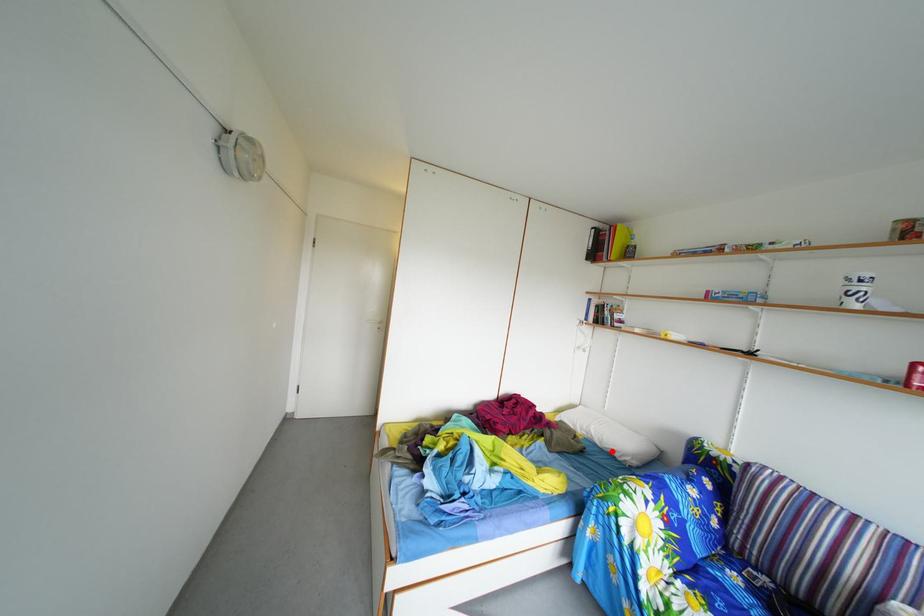
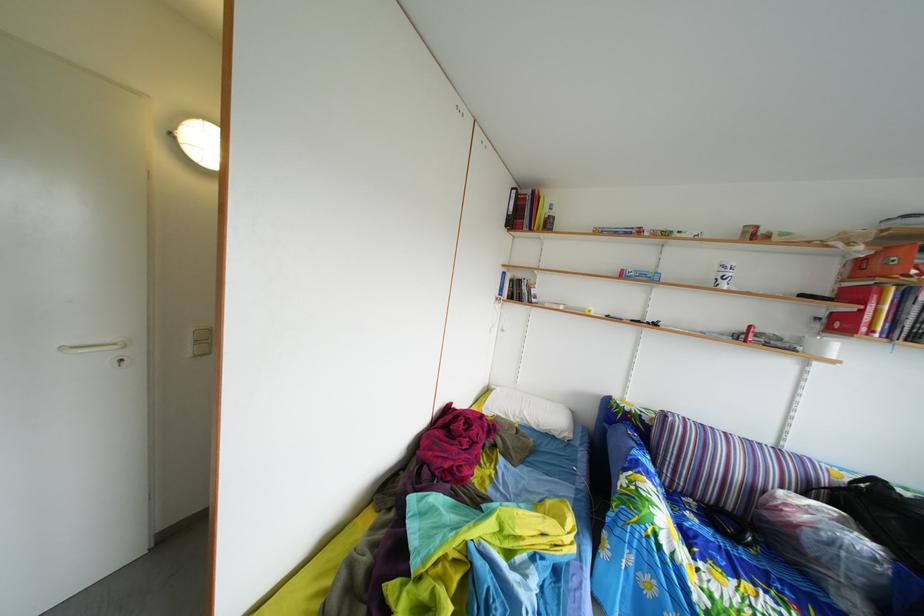
Question: I am providing you with two images of the same scene from different viewpoints. A red point is shown in image1. For the corresponding object point in image2, is it positioned nearer or farther from the camera?

Choices:
 (A) Nearer
 (B) Farther

Answer: (A)